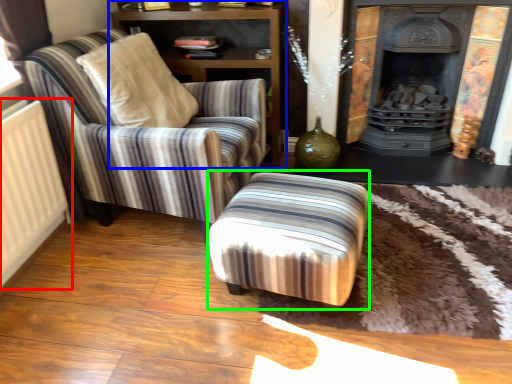
Question: Estimate the real-world distances between objects in this image. Which object is closer to radiator (highlighted by a red box), shelf (highlighted by a blue box) or stool (highlighted by a green box)?

Choices:
 (A) shelf
 (B) stool

Answer: (B)